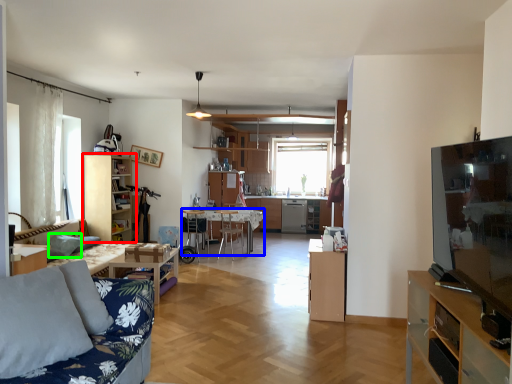
Question: Which is nearer to the cabinetry (highlighted by a red box)? table (highlighted by a blue box) or pillow (highlighted by a green box).

Choices:
 (A) table
 (B) pillow

Answer: (B)